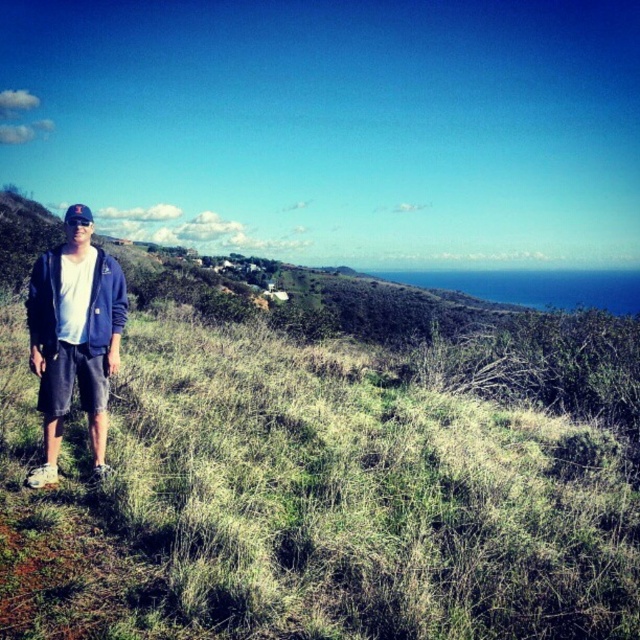
Question: Is matte blue jacket at left positioned at the back of blue fabric baseball cap at left?

Choices:
 (A) yes
 (B) no

Answer: (B)

Question: Does green grassy at center lie behind blue fabric baseball cap at left?

Choices:
 (A) yes
 (B) no

Answer: (B)

Question: Which of the following is the closest to the observer?

Choices:
 (A) green grassy at center
 (B) matte blue jacket at left

Answer: (A)

Question: Is green grassy at center wider than blue fabric baseball cap at left?

Choices:
 (A) no
 (B) yes

Answer: (A)

Question: Which point is farther from the camera taking this photo?

Choices:
 (A) (106, 390)
 (B) (138, 584)
 (C) (76, 216)

Answer: (A)

Question: Which point is farther from the camera taking this photo?

Choices:
 (A) (83, 348)
 (B) (80, 214)

Answer: (A)